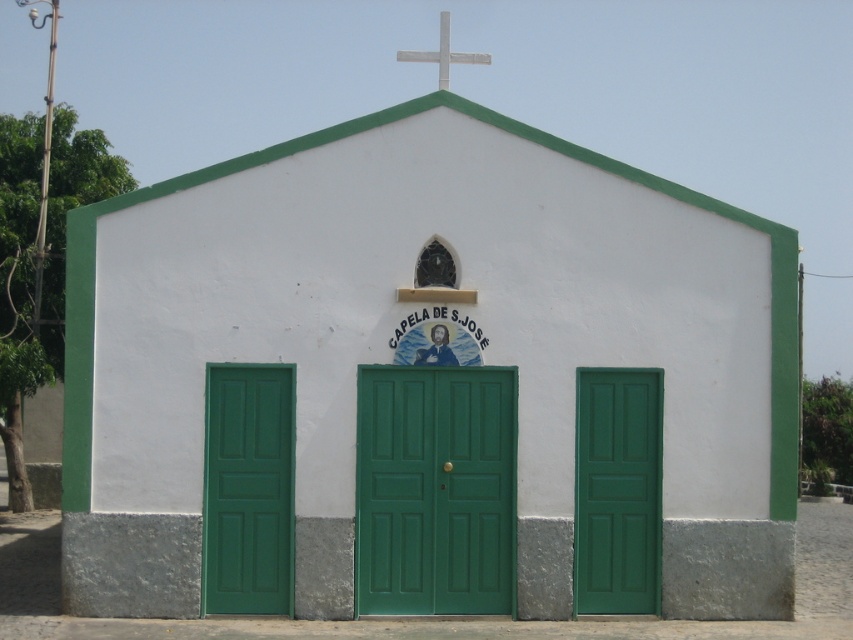
You are standing in front of the church and need to enter through one of the green matte doors. The green matte door at center is shorter than the green matte door at left. Which door should you choose if you want to enter through the taller one?

You should choose the green matte door at left because it is taller than the green matte door at center.

You are standing in front of the church and want to enter through the green matte door at right. Which direction should you walk relative to the white metallic cross at upper center to reach it?

The green matte door at right is located below the white metallic cross at upper center, so you should walk towards the bottom of the cross to reach the door.

You are a visitor approaching the church and want to enter. The green matte door at left and the white metallic cross at upper center are both visible. Which object is closer to your current position?

The green matte door at left is closer to your current position because it is smaller than the white metallic cross at upper center, indicating it is nearer to the observer.